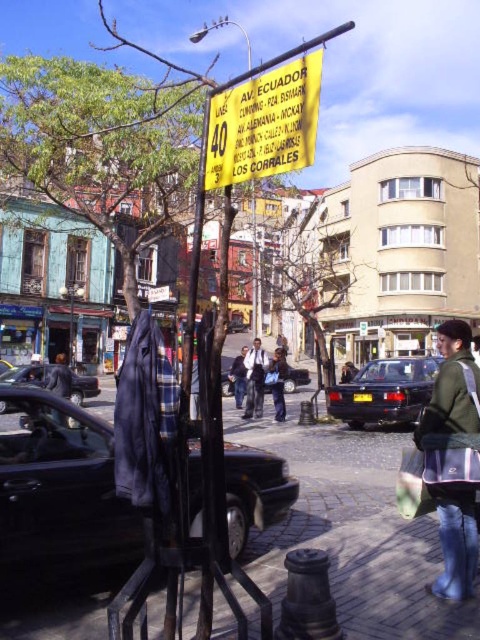
Question: In this image, where is shiny black car at left located relative to black glossy car at left?

Choices:
 (A) below
 (B) above

Answer: (A)

Question: Can you confirm if green fabric shopping bag at lower right is wider than black glossy car at left?

Choices:
 (A) yes
 (B) no

Answer: (B)

Question: Which object is positioned closest to the green fabric shopping bag at lower right?

Choices:
 (A) shiny black car at left
 (B) dark blue jeans at center
 (C) dark blue metallic sedan at center

Answer: (A)

Question: Is green fabric shopping bag at lower right thinner than dark blue jeans at center?

Choices:
 (A) yes
 (B) no

Answer: (A)

Question: Among these points, which one is nearest to the camera?

Choices:
 (A) (87, 419)
 (B) (274, 358)
 (C) (399, 481)
 (D) (261, 368)

Answer: (A)

Question: Which is nearer to the shiny black car at left?

Choices:
 (A) dark blue jeans at center
 (B) matte black jacket at center
 (C) black glossy car at left
 (D) green fabric jacket at lower right

Answer: (D)